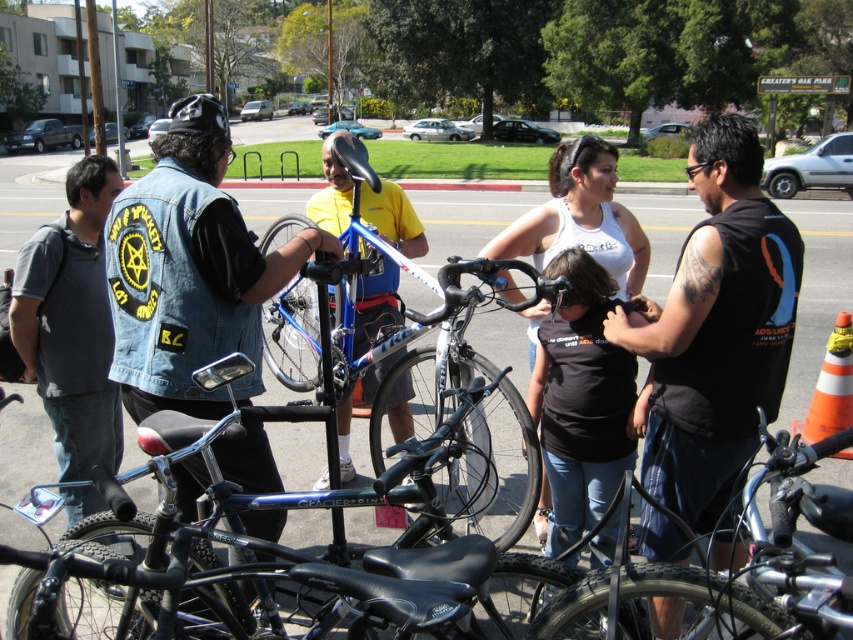
Is denim vest at center thinner than shiny black bike at center?

No.

Is denim vest at center positioned before shiny black bike at center?

No, denim vest at center is behind shiny black bike at center.

Is point (148, 317) more distant than point (825, 564)?

Yes, point (148, 317) is farther from viewer.

At what (x,y) coordinates should I click in order to perform the action: click on denim vest at center. Please return your answer as a coordinate pair (x, y). Looking at the image, I should click on (190, 272).

From the picture: Which is more to the left, shiny blue bike at center or dark gray shirt at left?

dark gray shirt at left is more to the left.

Is point (473, 563) farther from camera compared to point (102, 442)?

No, it is not.

Does point (120, 596) come farther from viewer compared to point (90, 348)?

No, it is in front of (90, 348).

The image size is (853, 640). In order to click on shiny blue bike at center in this screenshot , I will do `click(247, 563)`.

Looking at this image, can you confirm if dark gray shirt at left is positioned above black matte shirt at center?

Indeed, dark gray shirt at left is positioned over black matte shirt at center.

Does point (97, 256) come farther from viewer compared to point (566, 452)?

That is True.

Find the location of `dark gray shirt at left`. dark gray shirt at left is located at coordinates (71, 323).